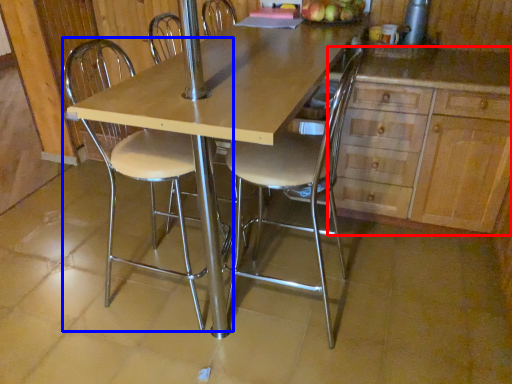
Question: Which point is closer to the camera, cabinetry (highlighted by a red box) or chair (highlighted by a blue box)?

Choices:
 (A) cabinetry
 (B) chair

Answer: (B)